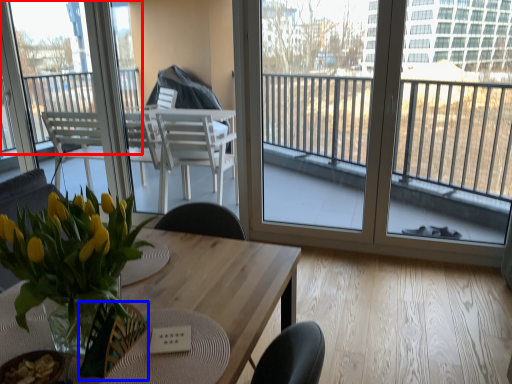
Question: Among these objects, which one is farthest to the camera, window (highlighted by a red box) or armchair (highlighted by a blue box)?

Choices:
 (A) window
 (B) armchair

Answer: (A)